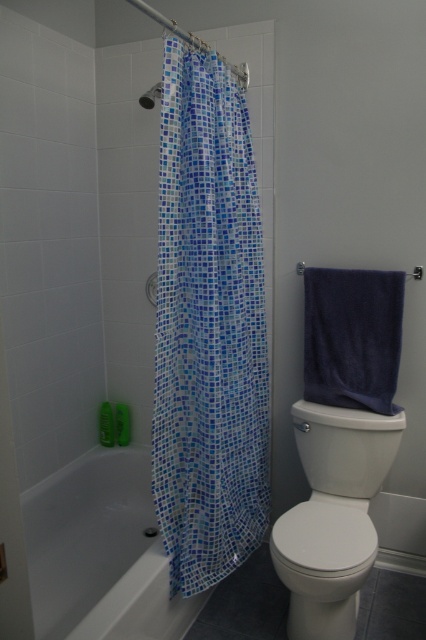
Can you confirm if blue mosaic fabric shower curtain at left is bigger than transparent plastic screen door at left?

Correct, blue mosaic fabric shower curtain at left is larger in size than transparent plastic screen door at left.

Is blue mosaic fabric shower curtain at left taller than transparent plastic screen door at left?

Yes.

This screenshot has height=640, width=426. What do you see at coordinates (207, 326) in the screenshot?
I see `blue mosaic fabric shower curtain at left` at bounding box center [207, 326].

I want to click on blue mosaic fabric shower curtain at left, so click(x=207, y=326).

Is white glossy bathtub at lower left in front of matte plastic shower head at upper left?

Yes.

Between point (86, 499) and point (138, 97), which one is positioned in front?

Point (138, 97) is more forward.

At what (x,y) coordinates should I click in order to perform the action: click on white glossy bathtub at lower left. Please return your answer as a coordinate pair (x, y). Looking at the image, I should click on (100, 552).

I want to click on white glossy bathtub at lower left, so click(100, 552).

Is point (307, 536) closer to viewer compared to point (11, 435)?

No, it is not.

Who is more distant from viewer, (368,442) or (0,536)?

The point (368,442) is behind.

Where is `white glossy toilet at lower right`? This screenshot has height=640, width=426. white glossy toilet at lower right is located at coordinates (333, 515).